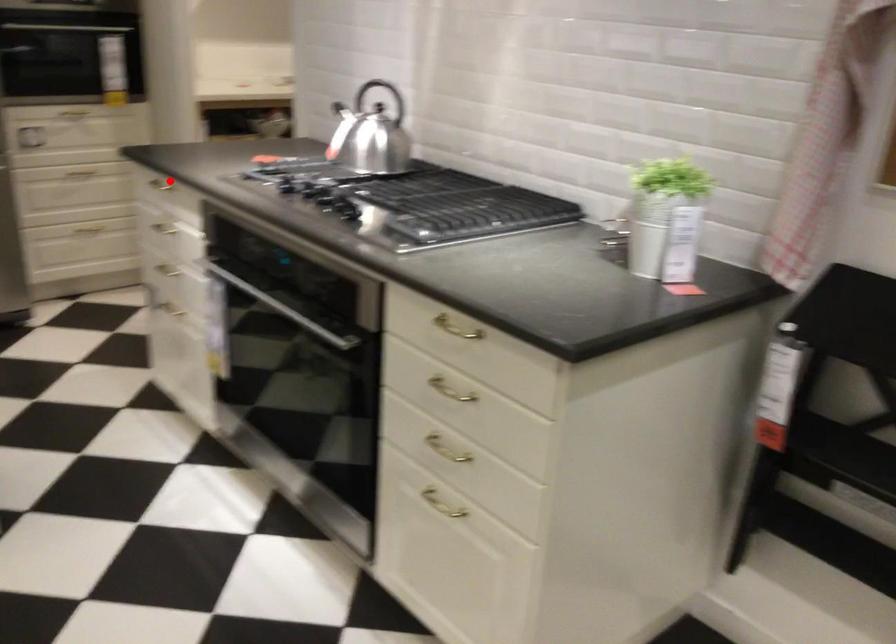
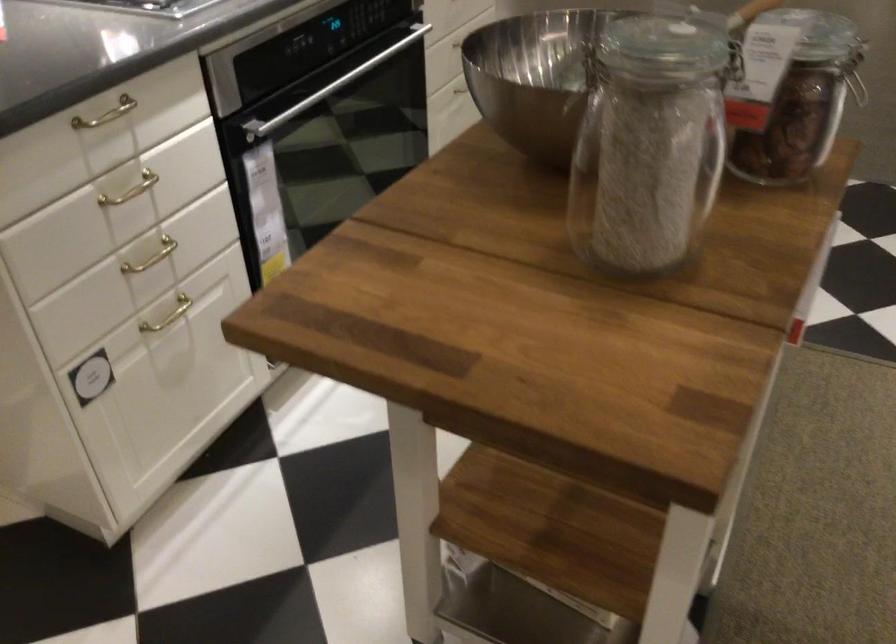
Question: A red point is marked in image1. In image2, is the corresponding 3D point closer to the camera or farther? Reply with the corresponding letter.

Choices:
 (A) The corresponding 3D point is closer.
 (B) The corresponding 3D point is farther.

Answer: (A)